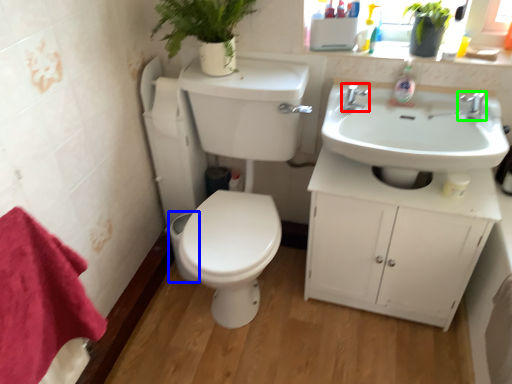
Question: Which object is positioned closest to tap (highlighted by a red box)? Select from toilet bowl (highlighted by a blue box) and tap (highlighted by a green box).

Choices:
 (A) toilet bowl
 (B) tap

Answer: (B)